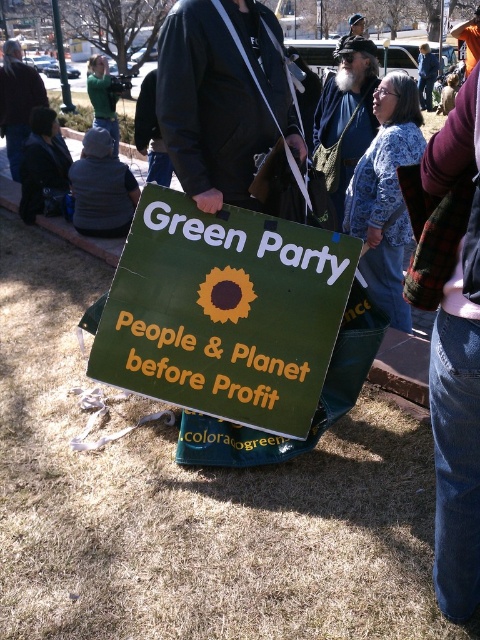
Question: Which object is closer to the camera taking this photo?

Choices:
 (A) bearded man with hat at upper center
 (B) black leather jacket at center

Answer: (B)

Question: Can you confirm if black leather jacket at center is positioned above dark gray jacket at upper left?

Choices:
 (A) no
 (B) yes

Answer: (A)

Question: Which object is positioned farthest from the gray fleece jacket at left?

Choices:
 (A) black leather jacket at center
 (B) bearded man with hat at upper center
 (C) green cardboard sign at center

Answer: (C)

Question: Where is black leather jacket at center located in relation to bearded man with hat at upper center in the image?

Choices:
 (A) below
 (B) above

Answer: (A)

Question: Which of these objects is positioned closest to the black leather jacket at center?

Choices:
 (A) bearded man with hat at upper center
 (B) green cardboard sign at center
 (C) dark gray jacket at upper left
 (D) gray fleece jacket at left

Answer: (B)

Question: Is black leather jacket at center closer to the viewer compared to bearded man with hat at upper center?

Choices:
 (A) yes
 (B) no

Answer: (A)